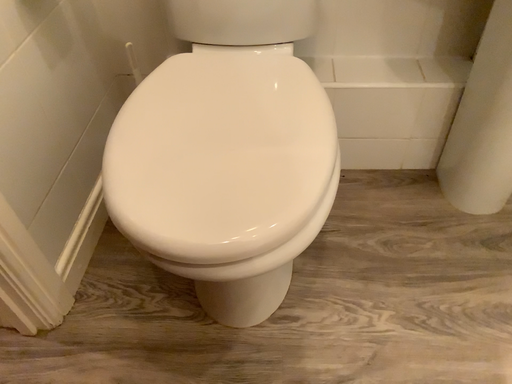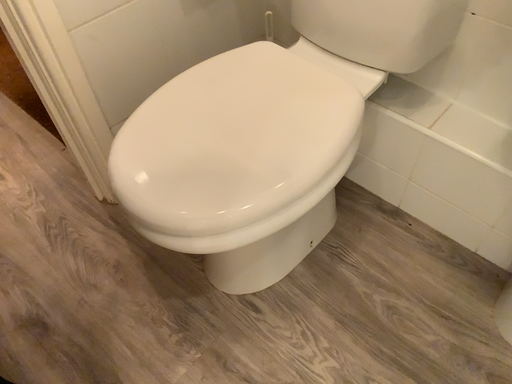
Question: How did the camera likely rotate when shooting the video?

Choices:
 (A) rotated right
 (B) rotated left

Answer: (B)